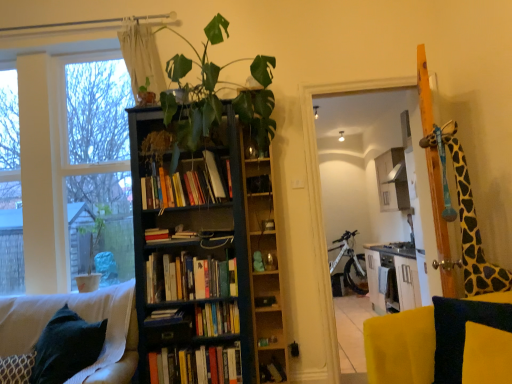
What do you see at coordinates (263, 261) in the screenshot? I see `wooden bookshelf at center` at bounding box center [263, 261].

Measure the distance between hardcover book at center, which is counted as the 4th book, starting from the top, and camera.

A distance of 2.47 meters exists between hardcover book at center, which is counted as the 4th book, starting from the top, and camera.

Describe the element at coordinates (68, 165) in the screenshot. I see `white painted wood at left` at that location.

You are a GUI agent. You are given a task and a screenshot of the screen. Output one action in this format:
    pyautogui.click(x=<x>, y=<y>)
    Task: Click on the hardcover books at center, the 5th book in the bottom-to-top sequence
    
    Given the screenshot: What is the action you would take?
    pyautogui.click(x=184, y=187)

Describe the element at coordinates (461, 331) in the screenshot. This screenshot has width=512, height=384. I see `yellow fabric pillow at lower right` at that location.

This screenshot has height=384, width=512. Identify the location of hardcover books at center, which is the 2th book from top to bottom. (189, 278).

Measure the distance between point [399,151] and camera.

A distance of 6.36 meters exists between point [399,151] and camera.

Find the location of `wooden bookshelf at center`. wooden bookshelf at center is located at coordinates point(263,261).

Find the location of a particular element. This screenshot has height=384, width=512. houseplant behind the wooden bookshelf at center is located at coordinates (92, 251).

Can you confirm if green matte plant at left, the second houseplant from the front, is wider than wooden bookshelf at center?

Yes, green matte plant at left, the second houseplant from the front, is wider than wooden bookshelf at center.

From the image's perspective, is green matte plant at left, marked as the 1th houseplant in a back-to-front arrangement, located beneath wooden bookshelf at center?

Indeed, from the image's perspective, green matte plant at left, marked as the 1th houseplant in a back-to-front arrangement, is shown beneath wooden bookshelf at center.

Is white sheer curtain at upper left to the left of white painted wood at left from the viewer's perspective?

No, white sheer curtain at upper left is not to the left of white painted wood at left.

Is white sheer curtain at upper left taller than white painted wood at left?

In fact, white sheer curtain at upper left may be shorter than white painted wood at left.

Can you confirm if white sheer curtain at upper left is thinner than white painted wood at left?

Indeed, white sheer curtain at upper left has a lesser width compared to white painted wood at left.

Looking at this image, would you say white painted wood at left is part of white sheer curtain at upper left's contents?

That's incorrect, white painted wood at left is not inside white sheer curtain at upper left.

Is dark blue wood bookcase at center facing away from white sheer curtain at upper left?

No, dark blue wood bookcase at center is not facing the opposite direction of white sheer curtain at upper left.

Is point (184, 260) positioned before point (139, 81)?

That is True.

Looking at this image, is dark blue wood bookcase at center taller than white sheer curtain at upper left?

Yes, dark blue wood bookcase at center is taller than white sheer curtain at upper left.

Is white sheer curtain at upper left completely or partially inside dark blue wood bookcase at center?

No, white sheer curtain at upper left is located outside of dark blue wood bookcase at center.

Considering the relative positions of white painted wood at left and velvet dark blue cushion at lower left in the image provided, is white painted wood at left to the left or to the right of velvet dark blue cushion at lower left?

white painted wood at left is to the left of velvet dark blue cushion at lower left.

Does white painted wood at left have a smaller size compared to velvet dark blue cushion at lower left?

No, white painted wood at left is not smaller than velvet dark blue cushion at lower left.

From a real-world perspective, is white painted wood at left located higher than velvet dark blue cushion at lower left?

Yes.

How much distance is there between white painted wood at left and velvet dark blue cushion at lower left?

white painted wood at left is 35.81 inches from velvet dark blue cushion at lower left.

From the picture: In terms of width, does white glossy cabinet at upper center look wider or thinner when compared to white matte bicycle at center?

In the image, white glossy cabinet at upper center appears to be more narrow than white matte bicycle at center.

Does white glossy cabinet at upper center touch white matte bicycle at center?

They are not placed beside each other.

Is white glossy cabinet at upper center positioned with its back to white matte bicycle at center?

No, white matte bicycle at center is not at the back of white glossy cabinet at upper center.

Which object is positioned more to the left, velvet dark blue cushion at lower left or hardcover books at center, the third book from the bottom?

From the viewer's perspective, velvet dark blue cushion at lower left appears more on the left side.

From a real-world perspective, is velvet dark blue cushion at lower left physically above hardcover books at center, the third book from the bottom?

Actually, velvet dark blue cushion at lower left is physically below hardcover books at center, the third book from the bottom, in the real world.

Is velvet dark blue cushion at lower left wider or thinner than hardcover books at center, the third book from the top?

Clearly, velvet dark blue cushion at lower left has more width compared to hardcover books at center, the third book from the top.

Is velvet dark blue cushion at lower left facing away from hardcover books at center, the third book from the top?

No, velvet dark blue cushion at lower left is not facing away from hardcover books at center, the third book from the top.

Which is further, (161, 379) or (109, 305)?

The point (161, 379) is farther.

In terms of height, does hardcover books at center, the 1th book when ordered from bottom to top, look taller or shorter compared to velvet dark blue cushion at lower left?

hardcover books at center, the 1th book when ordered from bottom to top, is shorter than velvet dark blue cushion at lower left.

Which object is wider, hardcover books at center, the 1th book when ordered from bottom to top, or velvet dark blue cushion at lower left?

velvet dark blue cushion at lower left.

Is hardcover books at center, the 1th book when ordered from bottom to top, bigger than velvet dark blue cushion at lower left?

Actually, hardcover books at center, the 1th book when ordered from bottom to top, might be smaller than velvet dark blue cushion at lower left.

There is a wooden bookshelf at center. Find the location of `the 1st houseplant above it (from a real-world perspective)`. the 1st houseplant above it (from a real-world perspective) is located at coordinates (92, 251).

At what (x,y) coordinates should I click in order to perform the action: click on window frame that is on the left side of white sheer curtain at upper left. Please return your answer as a coordinate pair (x, y). Looking at the image, I should click on (68, 165).

From the image, which object appears to be nearer to wooden bookshelf at center, yellow fabric pillow at lower right or matte white ceiling light at upper center?

yellow fabric pillow at lower right lies closer to wooden bookshelf at center than the other object.

From the image, which object appears to be farther from white matte bicycle at center, matte white ceiling light at upper center or yellow wood screen door at upper right?

Among the two, yellow wood screen door at upper right is located further to white matte bicycle at center.

Based on their spatial positions, is yellow wood screen door at upper right or white matte bicycle at center closer to hardcover books at center, the 1th book when ordered from bottom to top?

yellow wood screen door at upper right is positioned closer to the anchor hardcover books at center, the 1th book when ordered from bottom to top.

Looking at the image, which one is located further to green leafy plant at upper center, arranged as the 1th houseplant when viewed from the front, matte white ceiling light at upper center or green matte plant at left, marked as the 1th houseplant in a back-to-front arrangement?

matte white ceiling light at upper center lies further to green leafy plant at upper center, arranged as the 1th houseplant when viewed from the front, than the other object.

Based on their spatial positions, is hardcover books at center, the 5th book in the bottom-to-top sequence, or yellow wood screen door at upper right further from green matte plant at left, which is the second houseplant in top-to-bottom order?

Among the two, yellow wood screen door at upper right is located further to green matte plant at left, which is the second houseplant in top-to-bottom order.

Considering their positions, is velvet dark blue cushion at lower left positioned further to green matte plant at left, which is the first houseplant from bottom to top, than yellow wood screen door at upper right?

The object further to green matte plant at left, which is the first houseplant from bottom to top, is yellow wood screen door at upper right.

Based on their spatial positions, is hardcover books at center, the third book from the top, or yellow fabric pillow at lower right further from wooden bookshelf at center?

Among the two, yellow fabric pillow at lower right is located further to wooden bookshelf at center.

Looking at the image, which one is located further to green matte plant at left, the 1th houseplant in the left-to-right sequence, white sheer curtain at upper left or white glossy cabinet at upper center?

white glossy cabinet at upper center is positioned further to the anchor green matte plant at left, the 1th houseplant in the left-to-right sequence.

Image resolution: width=512 pixels, height=384 pixels. Identify the location of shelf between white sheer curtain at upper left and hardcover books at center, which is counted as the fourth book, starting from the bottom, in the up-down direction. (263, 261).

This screenshot has height=384, width=512. Identify the location of houseplant that lies between green leafy plant at upper center, the first houseplant positioned from the top, and hardcover books at center, which is the 5th book from top to bottom, from top to bottom. (92, 251).

Locate an element on the screen. cabinetry between hardcover books at center, the third book from the top, and matte white ceiling light at upper center in the front-back direction is located at coordinates (392, 180).

This screenshot has width=512, height=384. I want to click on chair between yellow fabric pillow at lower right and white glossy cabinet at upper center along the z-axis, so click(x=84, y=319).